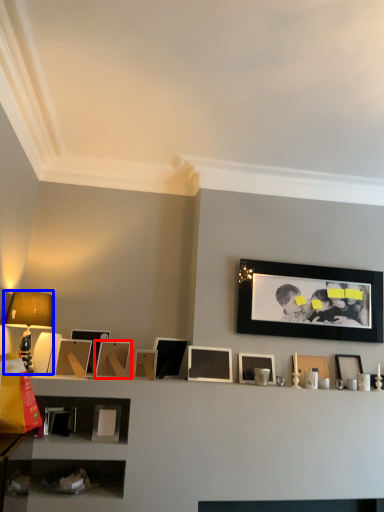
Question: Which object appears closest to the camera in this image, picture frame (highlighted by a red box) or table lamp (highlighted by a blue box)?

Choices:
 (A) picture frame
 (B) table lamp

Answer: (B)